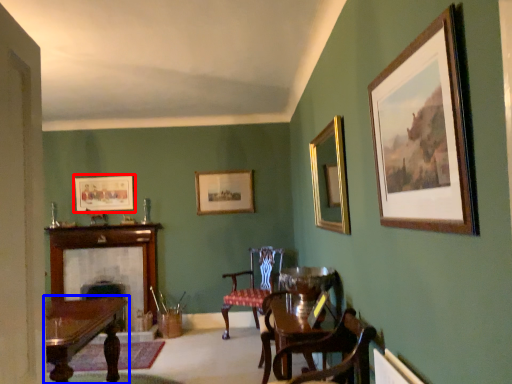
Question: Which object is further to the camera taking this photo, picture frame (highlighted by a red box) or table (highlighted by a blue box)?

Choices:
 (A) picture frame
 (B) table

Answer: (A)